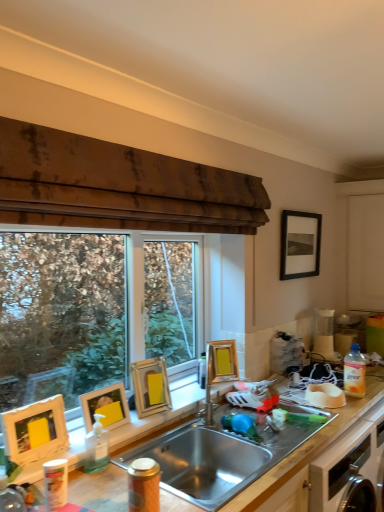
What is the approximate width of black matte picture frame at upper right, which is counted as the 5th picture frame, starting from the bottom?

black matte picture frame at upper right, which is counted as the 5th picture frame, starting from the bottom, is 1.87 inches wide.

The width and height of the screenshot is (384, 512). What do you see at coordinates (96, 447) in the screenshot?
I see `clear plastic bottle at sink, which is the second bottle from back to front` at bounding box center [96, 447].

Measure the distance between transparent glass window at left and camera.

transparent glass window at left and camera are 11.50 feet apart.

What do you see at coordinates (325, 395) in the screenshot?
I see `white matte bowl at right` at bounding box center [325, 395].

In order to face white matte picture frame at left, which appears as the fifth picture frame when viewed from the right, should I rotate leftwards or rightwards?

It's best to rotate left around 19.787 degrees.

This screenshot has width=384, height=512. I want to click on orange textured canister at sink, which appears as the third bottle when viewed from the back, so click(143, 485).

The image size is (384, 512). Describe the element at coordinates (219, 456) in the screenshot. I see `stainless steel sink at center` at that location.

Locate an element on the screen. The height and width of the screenshot is (512, 384). black matte picture frame at upper right, placed as the fifth picture frame when sorted from left to right is located at coordinates (300, 244).

Which object is thinner, white matte bowl at right or black matte picture frame at upper right, which ranks as the first picture frame in back-to-front order?

Thinner between the two is black matte picture frame at upper right, which ranks as the first picture frame in back-to-front order.

Does white matte bowl at right have a greater height compared to black matte picture frame at upper right, arranged as the first picture frame when viewed from the right?

In fact, white matte bowl at right may be shorter than black matte picture frame at upper right, arranged as the first picture frame when viewed from the right.

Can you confirm if white matte bowl at right is smaller than black matte picture frame at upper right, which ranks as the first picture frame in back-to-front order?

Indeed, white matte bowl at right has a smaller size compared to black matte picture frame at upper right, which ranks as the first picture frame in back-to-front order.

Is white matte bowl at right turned away from black matte picture frame at upper right, which is the fifth picture frame in front-to-back order?

No, white matte bowl at right's orientation is not away from black matte picture frame at upper right, which is the fifth picture frame in front-to-back order.

Is white matte bowl at right far from wooden cabinet at lower center?

That's not correct — white matte bowl at right is a little close to wooden cabinet at lower center.

Which object is further away from the camera taking this photo, white matte bowl at right or wooden cabinet at lower center?

white matte bowl at right is behind.

Is white matte bowl at right inside the boundaries of wooden cabinet at lower center, or outside?

white matte bowl at right lies outside wooden cabinet at lower center.

Considering the relative sizes of wooden cabinet at lower center and white matte picture frame at left, which is the first picture frame from front to back, in the image provided, is wooden cabinet at lower center taller than white matte picture frame at left, which is the first picture frame from front to back,?

No, wooden cabinet at lower center is not taller than white matte picture frame at left, which is the first picture frame from front to back.

Which is behind, point (343, 426) or point (56, 446)?

The point (343, 426) is farther from the camera.

Is wooden cabinet at lower center oriented away from white matte picture frame at left, which is the first picture frame from front to back?

No, wooden cabinet at lower center's orientation is not away from white matte picture frame at left, which is the first picture frame from front to back.

Considering the relative sizes of wooden cabinet at lower center and white matte picture frame at left, which is the 1th picture frame from left to right, in the image provided, is wooden cabinet at lower center wider than white matte picture frame at left, which is the 1th picture frame from left to right,?

Correct, the width of wooden cabinet at lower center exceeds that of white matte picture frame at left, which is the 1th picture frame from left to right.

Is white matte bowl at right facing away from transparent glass window at left?

No.

From the picture: Who is smaller, white matte bowl at right or transparent glass window at left?

With smaller size is white matte bowl at right.

Where is `bowl lying on the right of transparent glass window at left`? bowl lying on the right of transparent glass window at left is located at coordinates (325, 395).

How different are the orientations of transparent glass window at left and black matte picture frame at upper right, which is the first picture frame from top to bottom, in degrees?

They differ by 0.421 degrees in their facing directions.

Can you confirm if transparent glass window at left is shorter than black matte picture frame at upper right, which ranks as the first picture frame in back-to-front order?

Incorrect, the height of transparent glass window at left does not fall short of that of black matte picture frame at upper right, which ranks as the first picture frame in back-to-front order.

Measure the distance from transparent glass window at left to black matte picture frame at upper right, which ranks as the first picture frame in back-to-front order.

The distance of transparent glass window at left from black matte picture frame at upper right, which ranks as the first picture frame in back-to-front order, is 2.17 meters.

From a real-world perspective, is transparent glass window at left physically above black matte picture frame at upper right, which is the first picture frame from top to bottom?

Actually, transparent glass window at left is physically below black matte picture frame at upper right, which is the first picture frame from top to bottom, in the real world.

Is white matte cabinet at right taller than matte gold picture frame at upper left, arranged as the third picture frame when viewed from the right?

Yes.

From a real-world perspective, is white matte cabinet at right located higher than matte gold picture frame at upper left, which is counted as the 3th picture frame, starting from the front?

Correct, in the physical world, white matte cabinet at right is higher than matte gold picture frame at upper left, which is counted as the 3th picture frame, starting from the front.

Does white matte cabinet at right contain matte gold picture frame at upper left, arranged as the third picture frame when viewed from the right?

No, matte gold picture frame at upper left, arranged as the third picture frame when viewed from the right, is located outside of white matte cabinet at right.

Is white matte cabinet at right smaller than matte gold picture frame at upper left, arranged as the third picture frame when viewed from the right?

No.

Is translucent plastic bottle at right, the 3th bottle when ordered from left to right, facing away from black matte picture frame at upper right, which is the first picture frame from top to bottom?

No, translucent plastic bottle at right, the 3th bottle when ordered from left to right,'s orientation is not away from black matte picture frame at upper right, which is the first picture frame from top to bottom.

Which object is wider, translucent plastic bottle at right, marked as the third bottle in a front-to-back arrangement, or black matte picture frame at upper right, which ranks as the first picture frame in back-to-front order?

Wider between the two is translucent plastic bottle at right, marked as the third bottle in a front-to-back arrangement.

Based on the photo, from the image's perspective, is translucent plastic bottle at right, marked as the third bottle in a front-to-back arrangement, positioned above or below black matte picture frame at upper right, which ranks as the first picture frame in back-to-front order?

translucent plastic bottle at right, marked as the third bottle in a front-to-back arrangement, is below black matte picture frame at upper right, which ranks as the first picture frame in back-to-front order.

There is a translucent plastic bottle at right, the 1th bottle when ordered from back to front. Where is `the 4th picture frame above it (from a real-world perspective)`? The width and height of the screenshot is (384, 512). the 4th picture frame above it (from a real-world perspective) is located at coordinates (300, 244).

I want to click on picture frame to the right of white matte bowl at right, so click(300, 244).

Locate an element on the screen. The height and width of the screenshot is (512, 384). bowl located above the wooden cabinet at lower center (from the image's perspective) is located at coordinates (325, 395).

Consider the image. When comparing their distances from white matte bowl at right, does orange textured canister at sink, arranged as the first bottle when viewed from the front, or translucent plastic bottle at right, the 1th bottle when ordered from back to front, seem further?

orange textured canister at sink, arranged as the first bottle when viewed from the front, lies further to white matte bowl at right than the other object.

From the image, which object appears to be farther from white matte bowl at right, white matte cabinet at right or black matte picture frame at upper right, which is the first picture frame from top to bottom?

Based on the image, white matte cabinet at right appears to be further to white matte bowl at right.

Considering their positions, is transparent glass window at left positioned closer to yellow matte picture frame at left, marked as the 4th picture frame in a right-to-left arrangement, than white matte cabinet at right?

The object closer to yellow matte picture frame at left, marked as the 4th picture frame in a right-to-left arrangement, is white matte cabinet at right.

From the image, which object appears to be nearer to translucent plastic bottle at right, marked as the third bottle in a front-to-back arrangement, stainless steel sink at center or white matte bowl at right?

white matte bowl at right lies closer to translucent plastic bottle at right, marked as the third bottle in a front-to-back arrangement, than the other object.

Which object lies further to the anchor point translucent plastic bottle at right, marked as the third bottle in a front-to-back arrangement, transparent glass window at left or clear plastic bottle at sink, the second bottle in the front-to-back sequence?

Based on the image, transparent glass window at left appears to be further to translucent plastic bottle at right, marked as the third bottle in a front-to-back arrangement.

Estimate the real-world distances between objects in this image. Which object is closer to translucent plastic bottle at right, marked as the third bottle in a front-to-back arrangement, transparent glass window at left or wooden cabinet at lower center?

wooden cabinet at lower center.

Estimate the real-world distances between objects in this image. Which object is further from transparent glass window at left, gold metallic picture frame at upper center, which is the 2th picture frame in top-to-bottom order, or clear plastic bottle at sink, the second bottle in the front-to-back sequence?

clear plastic bottle at sink, the second bottle in the front-to-back sequence.

From the image, which object appears to be farther from black matte picture frame at upper right, which is the fifth picture frame in front-to-back order, orange textured canister at sink, arranged as the first bottle when viewed from the front, or yellow matte picture frame at left, marked as the 4th picture frame in a right-to-left arrangement?

Based on the image, orange textured canister at sink, arranged as the first bottle when viewed from the front, appears to be further to black matte picture frame at upper right, which is the fifth picture frame in front-to-back order.

The width and height of the screenshot is (384, 512). In order to click on window positioned between white matte picture frame at left, which is counted as the 2th picture frame, starting from the bottom, and matte gold picture frame at upper left, positioned as the third picture frame in top-to-bottom order, from near to far in this screenshot , I will do `click(98, 317)`.

In order to click on picture frame between clear plastic bottle at sink, the 3th bottle in the right-to-left sequence, and matte gold picture frame at upper left, positioned as the third picture frame in top-to-bottom order, in the front-back direction in this screenshot , I will do `click(105, 407)`.

Locate an element on the screen. The width and height of the screenshot is (384, 512). bowl located between wooden cabinet at lower center and black matte picture frame at upper right, which ranks as the first picture frame in back-to-front order, in the depth direction is located at coordinates (325, 395).

Identify the location of cabinetry between clear plastic bottle at sink, the 1th bottle in the left-to-right sequence, and stainless steel sink at center from left to right. (308, 449).